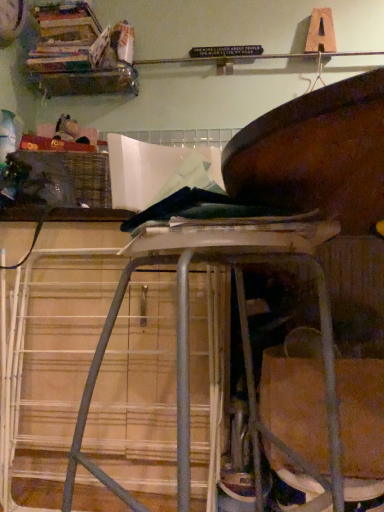
Identify the location of wooden books at upper left. This screenshot has height=512, width=384. (x=77, y=55).

Find the location of a particular element. The image size is (384, 512). woven plastic crate at left is located at coordinates (64, 178).

Considering the relative sizes of woven plastic crate at left and metal stool at center in the image provided, is woven plastic crate at left wider than metal stool at center?

No.

Which is in front, point (37, 183) or point (348, 166)?

Point (348, 166)

Is metal stool at center with wooden books at upper left?

metal stool at center and wooden books at upper left are clearly separated.

From a real-world perspective, is metal stool at center positioned above or below wooden books at upper left?

Clearly, from a real-world perspective, metal stool at center is below wooden books at upper left.

Between metal stool at center and wooden books at upper left, which one has more height?

metal stool at center is taller.

Does metal stool at center turn towards wooden books at upper left?

No, metal stool at center is not oriented towards wooden books at upper left.

Between wooden books at upper left and metal stool at center, which one has larger size?

metal stool at center.

Does wooden books at upper left have a greater height compared to metal stool at center?

No, wooden books at upper left is not taller than metal stool at center.

From the image's perspective, would you say wooden books at upper left is shown under metal stool at center?

No.

Which is in front, wooden books at upper left or metal stool at center?

metal stool at center is in front.

Could you tell me if metal stool at center is facing woven plastic crate at left?

No, metal stool at center is not oriented towards woven plastic crate at left.

From the image's perspective, does metal stool at center appear higher than woven plastic crate at left?

Incorrect, from the image's perspective, metal stool at center is lower than woven plastic crate at left.

In terms of width, does metal stool at center look wider or thinner when compared to woven plastic crate at left?

Clearly, metal stool at center has more width compared to woven plastic crate at left.

Is metal stool at center surrounding woven plastic crate at left?

No, woven plastic crate at left is not surrounded by metal stool at center.

Is wooden books at upper left far away from woven plastic crate at left?

Actually, wooden books at upper left and woven plastic crate at left are a little close together.

Considering the positions of point (70, 17) and point (67, 189), is point (70, 17) closer or farther from the camera than point (67, 189)?

Point (70, 17) appears to be farther away from the viewer than point (67, 189).

Considering the sizes of objects wooden books at upper left and woven plastic crate at left in the image provided, who is smaller, wooden books at upper left or woven plastic crate at left?

wooden books at upper left.

Considering the sizes of objects woven plastic crate at left and wooden books at upper left in the image provided, who is smaller, woven plastic crate at left or wooden books at upper left?

wooden books at upper left.

From a real-world perspective, which is physically below, woven plastic crate at left or wooden books at upper left?

woven plastic crate at left.

Which object is closer to the camera, woven plastic crate at left or wooden books at upper left?

woven plastic crate at left is closer to the camera.

There is a woven plastic crate at left. Where is `shelf above it (from a real-world perspective)`? shelf above it (from a real-world perspective) is located at coordinates (77, 55).

Where is `crate above the metal stool at center (from the image's perspective)`? crate above the metal stool at center (from the image's perspective) is located at coordinates (64, 178).

I want to click on furniture on the right of wooden books at upper left, so click(x=303, y=161).

Estimate the real-world distances between objects in this image. Which object is closer to woven plastic crate at left, metal stool at center or wooden books at upper left?

wooden books at upper left lies closer to woven plastic crate at left than the other object.

Based on their spatial positions, is wooden books at upper left or woven plastic crate at left closer to metal stool at center?

woven plastic crate at left is positioned closer to the anchor metal stool at center.

Estimate the real-world distances between objects in this image. Which object is closer to wooden books at upper left, metal stool at center or woven plastic crate at left?

woven plastic crate at left lies closer to wooden books at upper left than the other object.

Which object lies further to the anchor point woven plastic crate at left, wooden books at upper left or metal stool at center?

metal stool at center.

When comparing their distances from metal stool at center, does woven plastic crate at left or wooden books at upper left seem further?

Among the two, wooden books at upper left is located further to metal stool at center.

Estimate the real-world distances between objects in this image. Which object is closer to wooden books at upper left, woven plastic crate at left or metal stool at center?

woven plastic crate at left lies closer to wooden books at upper left than the other object.

Locate an element on the screen. The height and width of the screenshot is (512, 384). crate between metal stool at center and wooden books at upper left along the z-axis is located at coordinates (64, 178).